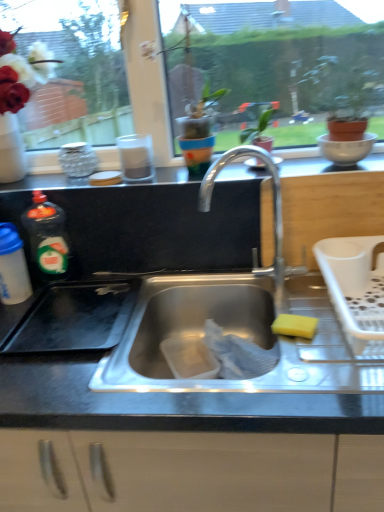
Question: Is black matte counter top at upper center wider or thinner than translucent plastic bottle at left, positioned as the 2th bottle in right-to-left order?

Choices:
 (A) thin
 (B) wide

Answer: (B)

Question: Is black matte counter top at upper center taller or shorter than translucent plastic bottle at left, marked as the first bottle in a left-to-right arrangement?

Choices:
 (A) short
 (B) tall

Answer: (A)

Question: Which of these objects is positioned closest to the white glossy bowl at upper right?

Choices:
 (A) polished metal faucet at center
 (B) translucent plastic bottle at left, placed as the 1th bottle when sorted from right to left
 (C) black matte counter top at upper center
 (D) transparent glass window screen at upper center
 (E) white plastic dish rack at right

Answer: (C)

Question: Estimate the real-world distances between objects in this image. Which object is farther from the polished metal faucet at center?

Choices:
 (A) green matte plant at upper right
 (B) white glossy bowl at upper right
 (C) translucent plastic bottle at left, positioned as the 2th bottle in right-to-left order
 (D) white plastic dish rack at right
 (E) yellow sponge at sink right

Answer: (C)